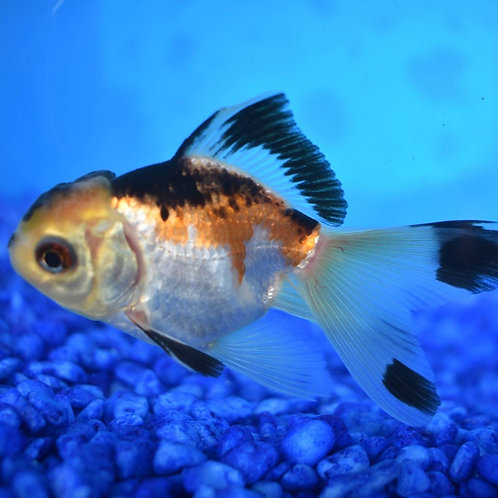
You are a GUI agent. You are given a task and a screenshot of the screen. Output one action in this format:
    pyautogui.click(x=<x>, y=<y>)
    Task: Click on the scales
    The image size is (498, 498).
    Given the screenshot: What is the action you would take?
    pyautogui.click(x=180, y=308), pyautogui.click(x=185, y=222), pyautogui.click(x=253, y=220), pyautogui.click(x=263, y=282)